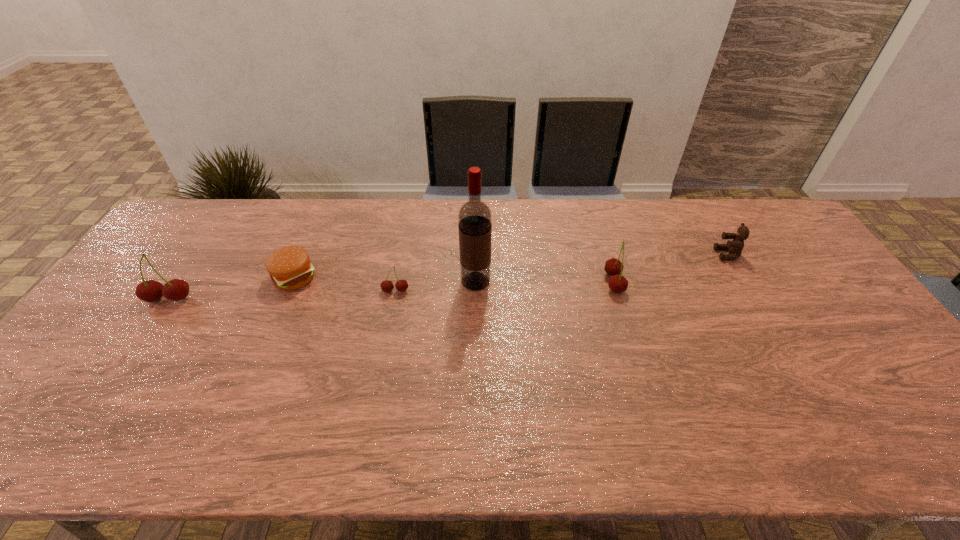
Find the location of a particular element. the leftmost object is located at coordinates (176, 289).

Where is `the second cherry from right to left`? This screenshot has height=540, width=960. the second cherry from right to left is located at coordinates (401, 285).

I want to click on the shortest cherry, so click(x=401, y=285).

Where is `the third tallest object`? the third tallest object is located at coordinates (613, 267).

The image size is (960, 540). Find the location of `the second shortest cherry`. the second shortest cherry is located at coordinates (613, 267).

The height and width of the screenshot is (540, 960). Find the location of `the rightmost object`. the rightmost object is located at coordinates (735, 247).

Image resolution: width=960 pixels, height=540 pixels. I want to click on wine bottle, so click(x=474, y=217).

You are a GUI agent. You are given a task and a screenshot of the screen. Output one action in this format:
    pyautogui.click(x=<x>, y=<y>)
    Task: Click on the third object from right to left
    The width and height of the screenshot is (960, 540).
    Given the screenshot: What is the action you would take?
    pyautogui.click(x=474, y=217)

At what (x,y) coordinates should I click in order to perform the action: click on hamburger. Please return your answer as a coordinate pair (x, y). The height and width of the screenshot is (540, 960). Looking at the image, I should click on (290, 268).

At what (x,y) coordinates should I click in order to perform the action: click on free space located 0.180m on the surface of the leftmost object. Please return your answer as a coordinate pair (x, y). Image resolution: width=960 pixels, height=540 pixels. Looking at the image, I should click on (127, 361).